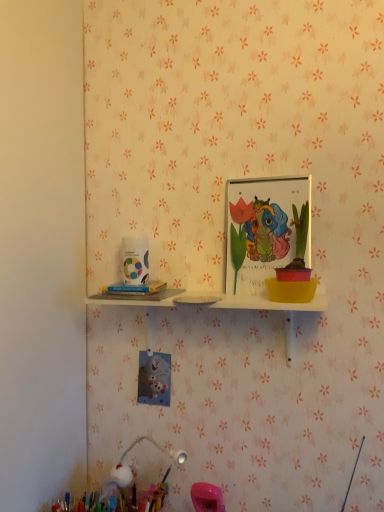
Question: Is matte plastic picture frame at upper center wider or thinner than pastel fluffy pom-pom at lower left?

Choices:
 (A) thin
 (B) wide

Answer: (A)

Question: Is point coord(274,194) closer or farther from the camera than point coord(62,501)?

Choices:
 (A) closer
 (B) farther

Answer: (A)

Question: Which is nearer to the matte plastic picture frame at upper center?

Choices:
 (A) white paper at left
 (B) white glossy plate at upper center
 (C) pastel fluffy pom-pom at lower left

Answer: (B)

Question: Which object is positioned farthest from the matte plastic picture frame at upper center?

Choices:
 (A) white glossy plate at upper center
 (B) white paper at left
 (C) pastel fluffy pom-pom at lower left

Answer: (C)